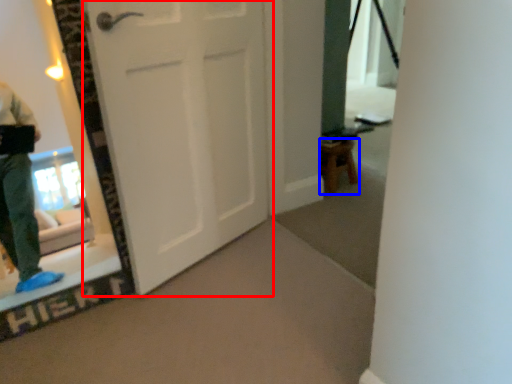
Question: Which object appears farthest to the camera in this image, door (highlighted by a red box) or furniture (highlighted by a blue box)?

Choices:
 (A) door
 (B) furniture

Answer: (B)